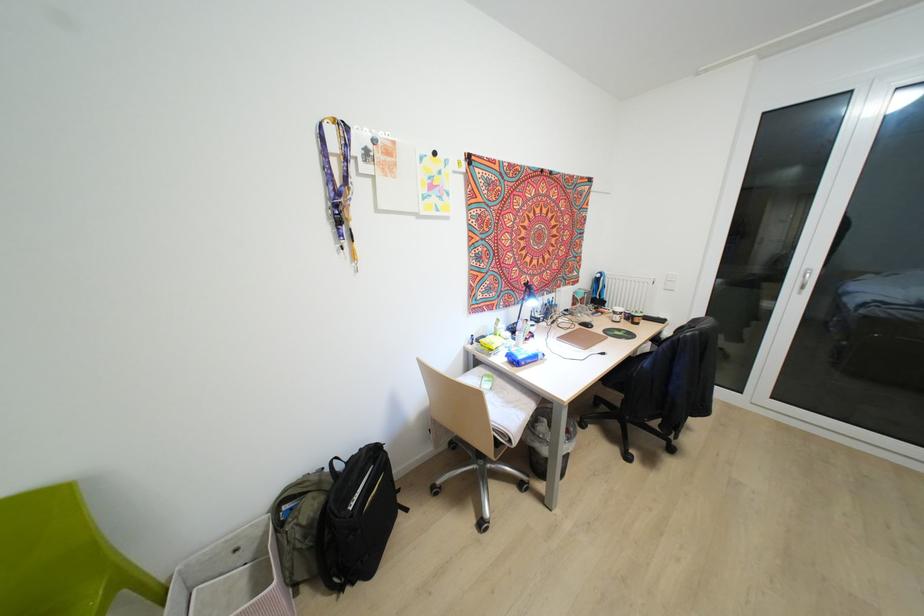
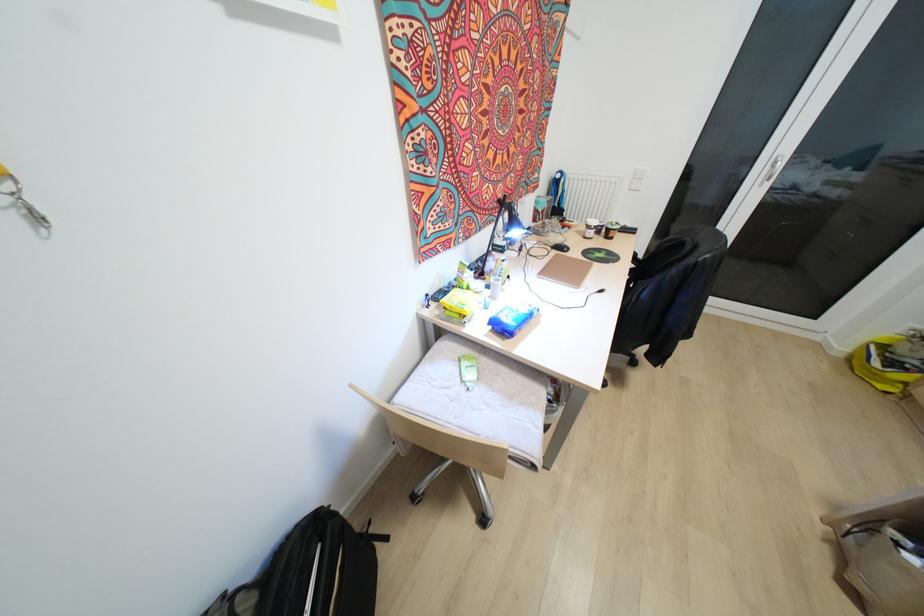
Question: The images are taken continuously from a first-person perspective. In which direction are you moving?

Choices:
 (A) Left
 (B) Right
 (C) Forward
 (D) Backward

Answer: (C)